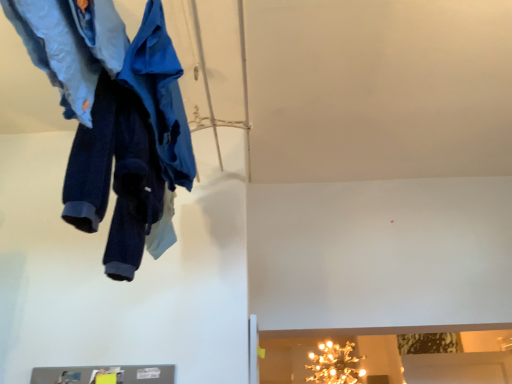
Question: From the image's perspective, is blue fabric coat at upper left under gold metallic chandelier at upper center?

Choices:
 (A) no
 (B) yes

Answer: (A)

Question: Considering the relative positions of blue fabric coat at upper left and gold metallic chandelier at upper center in the image provided, is blue fabric coat at upper left to the right of gold metallic chandelier at upper center from the viewer's perspective?

Choices:
 (A) yes
 (B) no

Answer: (B)

Question: Is blue fabric coat at upper left bigger than gold metallic chandelier at upper center?

Choices:
 (A) no
 (B) yes

Answer: (A)

Question: Is the position of blue fabric coat at upper left less distant than that of gold metallic chandelier at upper center?

Choices:
 (A) no
 (B) yes

Answer: (B)

Question: Is blue fabric coat at upper left turned away from gold metallic chandelier at upper center?

Choices:
 (A) yes
 (B) no

Answer: (B)

Question: Is blue fabric coat at upper left far from gold metallic chandelier at upper center?

Choices:
 (A) no
 (B) yes

Answer: (B)

Question: Is navy blue fleece pants at upper left, which is the second trousers from front to back, to the right of blue fabric coat at upper left from the viewer's perspective?

Choices:
 (A) yes
 (B) no

Answer: (B)

Question: Is navy blue fleece pants at upper left, which is the first trousers in back-to-front order, located outside blue fabric coat at upper left?

Choices:
 (A) yes
 (B) no

Answer: (A)

Question: From a real-world perspective, does navy blue fleece pants at upper left, which is the first trousers in back-to-front order, sit lower than blue fabric coat at upper left?

Choices:
 (A) yes
 (B) no

Answer: (A)

Question: Can you confirm if navy blue fleece pants at upper left, which is the first trousers in back-to-front order, is smaller than blue fabric coat at upper left?

Choices:
 (A) no
 (B) yes

Answer: (A)

Question: Could you tell me if navy blue fleece pants at upper left, which is the second trousers from front to back, is facing blue fabric coat at upper left?

Choices:
 (A) yes
 (B) no

Answer: (A)

Question: From a real-world perspective, is navy blue fleece pants at upper left, which is the first trousers in back-to-front order, physically above blue fabric coat at upper left?

Choices:
 (A) no
 (B) yes

Answer: (A)

Question: Is navy blue fleece pants at upper left, which is the first trousers in back-to-front order, at the back of denim pants at upper left, placed as the second trousers when sorted from back to front?

Choices:
 (A) no
 (B) yes

Answer: (A)